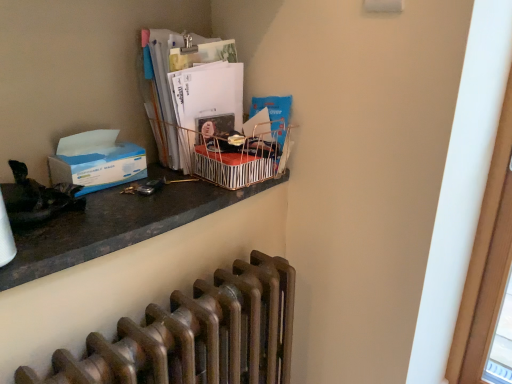
Question: Can you confirm if matte black desk at upper left is bigger than metallic striped basket at upper center?

Choices:
 (A) yes
 (B) no

Answer: (A)

Question: Considering the relative positions of matte black desk at upper left and metallic striped basket at upper center in the image provided, is matte black desk at upper left to the right of metallic striped basket at upper center from the viewer's perspective?

Choices:
 (A) no
 (B) yes

Answer: (A)

Question: Is matte black desk at upper left turned away from metallic striped basket at upper center?

Choices:
 (A) yes
 (B) no

Answer: (B)

Question: Is matte black desk at upper left not close to metallic striped basket at upper center?

Choices:
 (A) yes
 (B) no

Answer: (B)

Question: Can you confirm if matte black desk at upper left is wider than metallic striped basket at upper center?

Choices:
 (A) no
 (B) yes

Answer: (B)

Question: Is matte black desk at upper left further to camera compared to metallic striped basket at upper center?

Choices:
 (A) yes
 (B) no

Answer: (B)

Question: From a real-world perspective, is matte black desk at upper left physically above blue paper at left?

Choices:
 (A) yes
 (B) no

Answer: (B)

Question: Is matte black desk at upper left looking in the opposite direction of blue paper at left?

Choices:
 (A) no
 (B) yes

Answer: (A)

Question: Is there a large distance between matte black desk at upper left and blue paper at left?

Choices:
 (A) yes
 (B) no

Answer: (B)

Question: Does matte black desk at upper left appear on the right side of blue paper at left?

Choices:
 (A) yes
 (B) no

Answer: (A)

Question: From a real-world perspective, is matte black desk at upper left physically below blue paper at left?

Choices:
 (A) no
 (B) yes

Answer: (B)

Question: From the image's perspective, is matte black desk at upper left on top of blue paper at left?

Choices:
 (A) no
 (B) yes

Answer: (A)

Question: Can you confirm if bronze metallic radiator at lower center is wider than metallic striped basket at upper center?

Choices:
 (A) no
 (B) yes

Answer: (A)